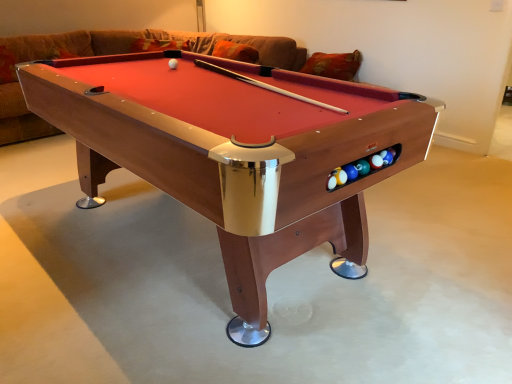
Question: Does white matte ball at center have a greater width compared to wooden billiard table at center?

Choices:
 (A) no
 (B) yes

Answer: (A)

Question: Considering the relative sizes of white matte ball at center and wooden billiard table at center in the image provided, is white matte ball at center taller than wooden billiard table at center?

Choices:
 (A) no
 (B) yes

Answer: (A)

Question: From a real-world perspective, is white matte ball at center physically below wooden billiard table at center?

Choices:
 (A) no
 (B) yes

Answer: (A)

Question: Is white matte ball at center beside wooden billiard table at center?

Choices:
 (A) yes
 (B) no

Answer: (B)

Question: Is white matte ball at center facing away from wooden billiard table at center?

Choices:
 (A) no
 (B) yes

Answer: (B)

Question: Is white matte ball at center oriented towards wooden billiard table at center?

Choices:
 (A) yes
 (B) no

Answer: (A)

Question: Considering the relative positions of white matte ball at center and brown fabric couch at upper center in the image provided, is white matte ball at center to the left of brown fabric couch at upper center from the viewer's perspective?

Choices:
 (A) yes
 (B) no

Answer: (B)

Question: Is white matte ball at center facing away from brown fabric couch at upper center?

Choices:
 (A) no
 (B) yes

Answer: (A)

Question: Can you confirm if white matte ball at center is positioned to the right of brown fabric couch at upper center?

Choices:
 (A) yes
 (B) no

Answer: (A)

Question: Is white matte ball at center outside of brown fabric couch at upper center?

Choices:
 (A) no
 (B) yes

Answer: (B)

Question: From a real-world perspective, is white matte ball at center physically above brown fabric couch at upper center?

Choices:
 (A) yes
 (B) no

Answer: (A)

Question: Does white matte ball at center have a greater height compared to brown fabric couch at upper center?

Choices:
 (A) yes
 (B) no

Answer: (B)

Question: Considering the relative sizes of wooden billiard table at center and brown fabric couch at upper center in the image provided, is wooden billiard table at center wider than brown fabric couch at upper center?

Choices:
 (A) yes
 (B) no

Answer: (B)